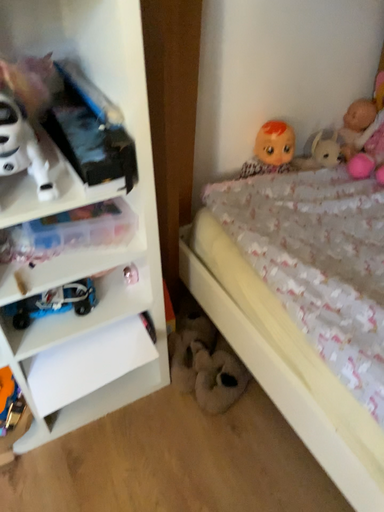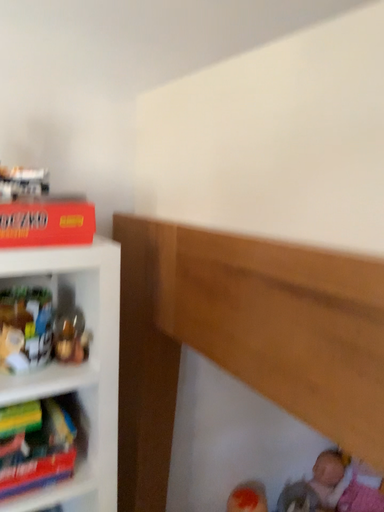
Question: How did the camera likely rotate when shooting the video?

Choices:
 (A) rotated downward
 (B) rotated upward

Answer: (B)